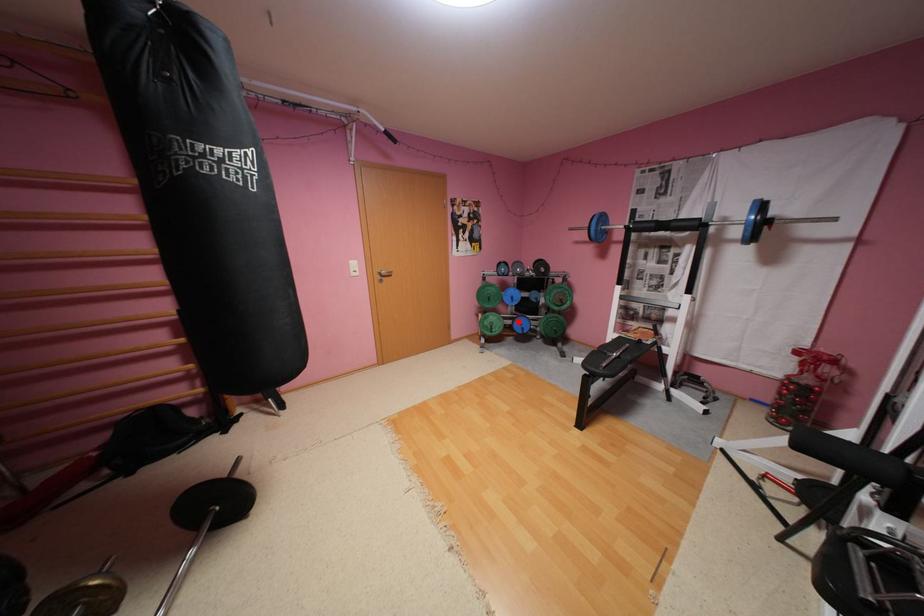
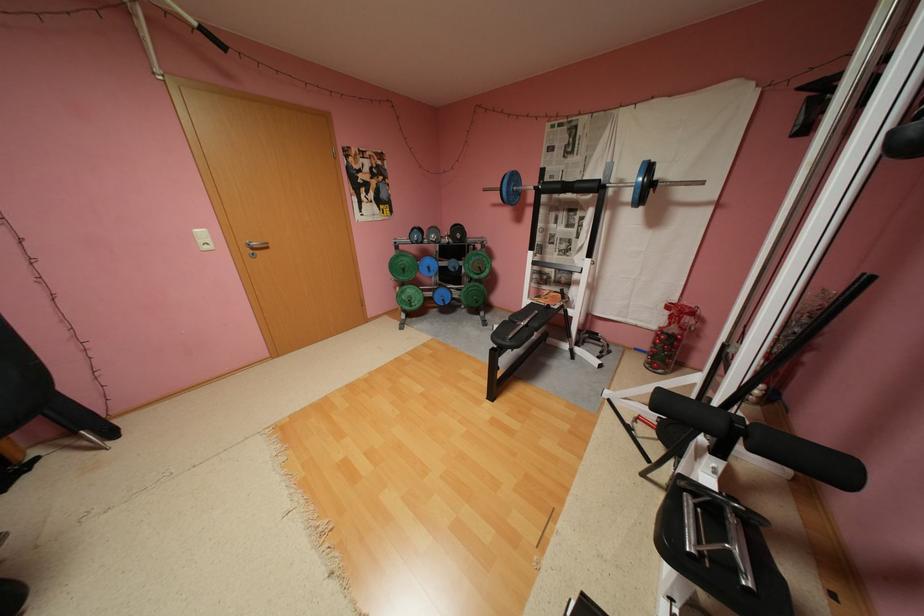
In the second image, find the point that corresponds to the highlighted location in the first image.

(439, 294)